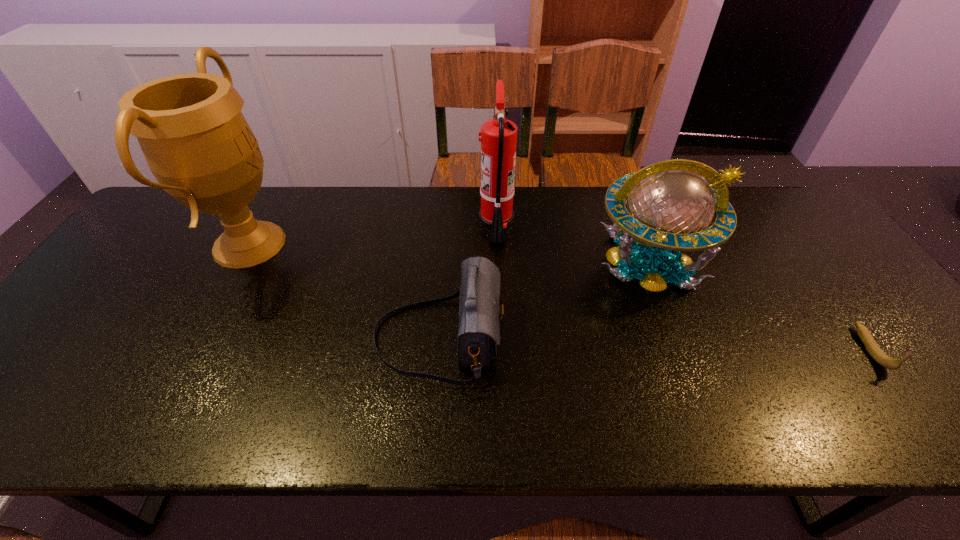
You are a GUI agent. You are given a task and a screenshot of the screen. Output one action in this format:
    pyautogui.click(x=<x>, y=<y>)
    Task: Click on the leftmost object
    
    Given the screenshot: What is the action you would take?
    pyautogui.click(x=197, y=143)

The width and height of the screenshot is (960, 540). Find the location of `trophy`. trophy is located at coordinates (197, 143).

The height and width of the screenshot is (540, 960). I want to click on fire extinguisher, so click(498, 139).

Identify the location of the third shortest object. (671, 207).

Find the location of a particular element. Image resolution: width=960 pixels, height=540 pixels. globe is located at coordinates (671, 207).

I want to click on the fourth tallest object, so click(479, 312).

In order to click on the rightmost object in this screenshot , I will do `click(874, 350)`.

This screenshot has height=540, width=960. I want to click on banana, so click(x=874, y=350).

At what (x,y) coordinates should I click in order to perform the action: click on vacant space situated on the engravings side of the tallest object. Please return your answer as a coordinate pair (x, y). The height and width of the screenshot is (540, 960). Looking at the image, I should click on (396, 244).

At what (x,y) coordinates should I click in order to perform the action: click on free space located 0.280m at the nozzle of the second tallest object. Please return your answer as a coordinate pair (x, y). Image resolution: width=960 pixels, height=540 pixels. Looking at the image, I should click on (387, 225).